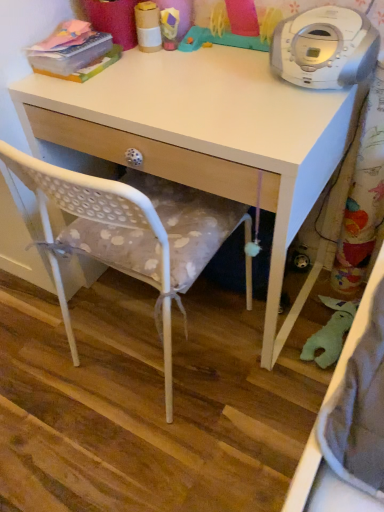
What are the coordinates of `free point in front of cardboard tube at upper center, which is the 1th toy from left to right` in the screenshot? It's located at (152, 76).